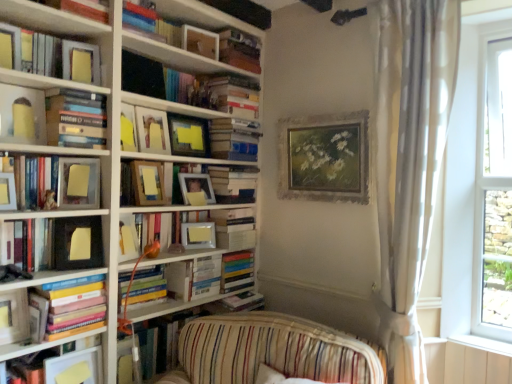
Where is `matte glass picture frame at left, which ranks as the eighth picture frame in right-to-left order`? This screenshot has height=384, width=512. matte glass picture frame at left, which ranks as the eighth picture frame in right-to-left order is located at coordinates (78, 183).

What do you see at coordinates (73, 306) in the screenshot? This screenshot has height=384, width=512. I see `hardcover books at left, which is the fourteenth book from top to bottom` at bounding box center [73, 306].

Measure the distance between hardcover books at left, the 8th book ordered from the bottom, and camera.

hardcover books at left, the 8th book ordered from the bottom, and camera are 5.34 feet apart.

The image size is (512, 384). Describe the element at coordinates (187, 85) in the screenshot. I see `matte black book at upper center, which is the 5th book from top to bottom` at that location.

Image resolution: width=512 pixels, height=384 pixels. Describe the element at coordinates (59, 243) in the screenshot. I see `matte black frame at left, which is the third book from bottom to top` at that location.

You are a GUI agent. You are given a task and a screenshot of the screen. Output one action in this format:
    pyautogui.click(x=<x>, y=<y>)
    Task: Click on the hardcover book at center, which ranks as the tenth book in top-to-bottom order
    
    Given the screenshot: What is the action you would take?
    pyautogui.click(x=233, y=183)

Considering the relative positions of wooden book at upper center, the fourth book when ordered from top to bottom, and matte black picture frame at upper left, positioned as the second picture frame in left-to-right order, in the image provided, is wooden book at upper center, the fourth book when ordered from top to bottom, to the left or to the right of matte black picture frame at upper left, positioned as the second picture frame in left-to-right order,?

wooden book at upper center, the fourth book when ordered from top to bottom, is to the right of matte black picture frame at upper left, positioned as the second picture frame in left-to-right order.

Would you consider wooden book at upper center, marked as the twelfth book in a bottom-to-top arrangement, to be distant from matte black picture frame at upper left, positioned as the second picture frame in left-to-right order?

Yes, wooden book at upper center, marked as the twelfth book in a bottom-to-top arrangement, is far from matte black picture frame at upper left, positioned as the second picture frame in left-to-right order.

From the image's perspective, between wooden book at upper center, the fourth book when ordered from top to bottom, and matte black picture frame at upper left, positioned as the second picture frame in left-to-right order, who is located below?

matte black picture frame at upper left, positioned as the second picture frame in left-to-right order, from the image's perspective.

Considering the sizes of objects wooden book at upper center, marked as the twelfth book in a bottom-to-top arrangement, and matte black picture frame at upper left, which is the 9th picture frame from right to left, in the image provided, who is smaller, wooden book at upper center, marked as the twelfth book in a bottom-to-top arrangement, or matte black picture frame at upper left, which is the 9th picture frame from right to left,?

matte black picture frame at upper left, which is the 9th picture frame from right to left.

Is hardcover book at upper left, marked as the fifteenth book in a bottom-to-top arrangement, positioned far away from yellow sticky note paper at lower left, placed as the 15th book when sorted from top to bottom?

Yes.

Is hardcover book at upper left, marked as the fifteenth book in a bottom-to-top arrangement, inside or outside of yellow sticky note paper at lower left, the 1th book from the bottom?

hardcover book at upper left, marked as the fifteenth book in a bottom-to-top arrangement, is spatially situated outside yellow sticky note paper at lower left, the 1th book from the bottom.

From the image's perspective, is hardcover book at upper left, placed as the first book when sorted from top to bottom, on top of yellow sticky note paper at lower left, placed as the 15th book when sorted from top to bottom?

Yes.

Which point is more forward, (x=69, y=6) or (x=54, y=342)?

The point (x=54, y=342) is closer.

Who is taller, matte yellow paper at upper center, the 5th picture frame viewed from the right, or matte wooden book at center, the twelfth book when ordered from top to bottom?

matte yellow paper at upper center, the 5th picture frame viewed from the right, is taller.

From a real-world perspective, is matte yellow paper at upper center, the sixth picture frame from the left, above or below matte wooden book at center, the twelfth book when ordered from top to bottom?

matte yellow paper at upper center, the sixth picture frame from the left, is situated higher than matte wooden book at center, the twelfth book when ordered from top to bottom, in the real world.

Is matte yellow paper at upper center, the sixth picture frame from the left, next to matte wooden book at center, positioned as the 4th book in bottom-to-top order, and touching it?

matte yellow paper at upper center, the sixth picture frame from the left, and matte wooden book at center, positioned as the 4th book in bottom-to-top order, are clearly separated.

From the image's perspective, which object appears higher, matte yellow paper at upper center, the sixth picture frame from the left, or matte wooden book at center, positioned as the 4th book in bottom-to-top order?

matte yellow paper at upper center, the sixth picture frame from the left, from the image's perspective.

From the image's perspective, would you say hardcover book at center, positioned as the sixth book in bottom-to-top order, is shown under matte wooden book at center, positioned as the 4th book in bottom-to-top order?

No.

From a real-world perspective, relative to matte wooden book at center, the twelfth book when ordered from top to bottom, is hardcover book at center, positioned as the sixth book in bottom-to-top order, vertically above or below?

From a real-world perspective, hardcover book at center, positioned as the sixth book in bottom-to-top order, is physically above matte wooden book at center, the twelfth book when ordered from top to bottom.

Is hardcover book at center, which ranks as the tenth book in top-to-bottom order, placed right next to matte wooden book at center, positioned as the 4th book in bottom-to-top order?

No, hardcover book at center, which ranks as the tenth book in top-to-bottom order, is not next to matte wooden book at center, positioned as the 4th book in bottom-to-top order.

Is hardcover book at center, positioned as the sixth book in bottom-to-top order, oriented towards matte wooden book at center, the twelfth book when ordered from top to bottom?

No.

Can you tell me how much matte black picture frame at upper left, which is the 9th picture frame from right to left, and hardcover book at upper left, marked as the fifteenth book in a bottom-to-top arrangement, differ in facing direction?

They differ by 2.38 degrees in their facing directions.

Considering the relative positions of matte black picture frame at upper left, which is the 9th picture frame from right to left, and hardcover book at upper left, placed as the first book when sorted from top to bottom, in the image provided, is matte black picture frame at upper left, which is the 9th picture frame from right to left, to the left of hardcover book at upper left, placed as the first book when sorted from top to bottom, from the viewer's perspective?

Indeed, matte black picture frame at upper left, which is the 9th picture frame from right to left, is positioned on the left side of hardcover book at upper left, placed as the first book when sorted from top to bottom.

Relative to hardcover book at upper left, marked as the fifteenth book in a bottom-to-top arrangement, is matte black picture frame at upper left, which is the 9th picture frame from right to left, in front or behind?

Visually, matte black picture frame at upper left, which is the 9th picture frame from right to left, is located in front of hardcover book at upper left, marked as the fifteenth book in a bottom-to-top arrangement.

Considering the sizes of matte black picture frame at upper left, which is the 9th picture frame from right to left, and matte silver picture frame at left, which is counted as the tenth picture frame, starting from the right, in the image, is matte black picture frame at upper left, which is the 9th picture frame from right to left, taller or shorter than matte silver picture frame at left, which is counted as the tenth picture frame, starting from the right,?

Clearly, matte black picture frame at upper left, which is the 9th picture frame from right to left, is taller compared to matte silver picture frame at left, which is counted as the tenth picture frame, starting from the right.

Is matte silver picture frame at left, which is counted as the tenth picture frame, starting from the right, at the back of matte black picture frame at upper left, positioned as the second picture frame in left-to-right order?

matte black picture frame at upper left, positioned as the second picture frame in left-to-right order, does not have its back to matte silver picture frame at left, which is counted as the tenth picture frame, starting from the right.

Is matte black picture frame at upper left, which is the 9th picture frame from right to left, outside of matte silver picture frame at left, which is counted as the tenth picture frame, starting from the right?

Yes, matte black picture frame at upper left, which is the 9th picture frame from right to left, is not within matte silver picture frame at left, which is counted as the tenth picture frame, starting from the right.

Could you measure the distance between matte black picture frame at upper left, positioned as the second picture frame in left-to-right order, and matte silver picture frame at left, positioned as the 1th picture frame in left-to-right order?

matte black picture frame at upper left, positioned as the second picture frame in left-to-right order, is 18.49 inches from matte silver picture frame at left, positioned as the 1th picture frame in left-to-right order.

Which paperback book is the 2nd one when counting from the left side of the striped fabric armchair at lower center? Please provide its 2D coordinates.

[(77, 243)]

Is yellow paper at left, which ranks as the first paperback book in bottom-to-top order, far from striped fabric armchair at lower center?

yellow paper at left, which ranks as the first paperback book in bottom-to-top order, is actually quite close to striped fabric armchair at lower center.

Can you confirm if yellow paper at left, which ranks as the first paperback book in bottom-to-top order, is thinner than striped fabric armchair at lower center?

Indeed, yellow paper at left, which ranks as the first paperback book in bottom-to-top order, has a lesser width compared to striped fabric armchair at lower center.

Where is `the 12th book behind when counting from the matte black picture frame at upper left, positioned as the second picture frame in left-to-right order`? The width and height of the screenshot is (512, 384). the 12th book behind when counting from the matte black picture frame at upper left, positioned as the second picture frame in left-to-right order is located at coordinates pos(239,50).

Where is `the 14th book below the hardcover book at upper left, placed as the first book when sorted from top to bottom (from the image's perspective)`? the 14th book below the hardcover book at upper left, placed as the first book when sorted from top to bottom (from the image's perspective) is located at coordinates (42, 345).

Based on their spatial positions, is yellow sticky note paper at lower left, the 1th book from the bottom, or matte black book at upper center, which is the 5th book from top to bottom, further from hardcover books at center, which is the seventh book in bottom-to-top order?

The object further to hardcover books at center, which is the seventh book in bottom-to-top order, is yellow sticky note paper at lower left, the 1th book from the bottom.

Considering their positions, is matte black picture frame at upper left, which is the 9th picture frame from right to left, positioned further to matte glass picture frame at left, which ranks as the eighth picture frame in right-to-left order, than wooden bookcase at left?

matte black picture frame at upper left, which is the 9th picture frame from right to left, is positioned further to the anchor matte glass picture frame at left, which ranks as the eighth picture frame in right-to-left order.

Estimate the real-world distances between objects in this image. Which object is closer to matte plastic picture frame at upper center, placed as the seventh picture frame when sorted from left to right, wooden picture frame at upper center, acting as the 9th picture frame starting from the left, or hardcover book at upper left, marked as the fifteenth book in a bottom-to-top arrangement?

wooden picture frame at upper center, acting as the 9th picture frame starting from the left, is closer to matte plastic picture frame at upper center, placed as the seventh picture frame when sorted from left to right.

Based on their spatial positions, is hardcover book at upper center, which is the 14th book in bottom-to-top order, or yellow sticky note paper at lower left, placed as the 15th book when sorted from top to bottom, further from matte yellow sticky note at upper left, which ranks as the 7th book in top-to-bottom order?

yellow sticky note paper at lower left, placed as the 15th book when sorted from top to bottom, is further to matte yellow sticky note at upper left, which ranks as the 7th book in top-to-bottom order.

In the scene shown: Based on their spatial positions, is matte wooden shelf at center, the 2th shelf in the top-to-bottom sequence, or matte silver picture frame at left, positioned as the 1th picture frame in left-to-right order, closer to wooden picture frame at upper center, marked as the second picture frame in a right-to-left arrangement?

matte silver picture frame at left, positioned as the 1th picture frame in left-to-right order, lies closer to wooden picture frame at upper center, marked as the second picture frame in a right-to-left arrangement, than the other object.

From the image, which object appears to be nearer to wooden bookcase at left, matte wooden book at center, positioned as the 4th book in bottom-to-top order, or wooden picture frame at center, which is counted as the 4th picture frame, starting from the left?

wooden picture frame at center, which is counted as the 4th picture frame, starting from the left, is positioned closer to the anchor wooden bookcase at left.

Considering their positions, is wooden book at upper center, the fourth book when ordered from top to bottom, positioned closer to matte yellow sticky note at upper left, which ranks as the 7th book in top-to-bottom order, than wooden picture frame at upper center, marked as the second picture frame in a right-to-left arrangement?

Based on the image, wooden picture frame at upper center, marked as the second picture frame in a right-to-left arrangement, appears to be nearer to matte yellow sticky note at upper left, which ranks as the 7th book in top-to-bottom order.

When comparing their distances from matte black book at upper center, which appears as the 11th book when ordered from the bottom, does wooden frame at center, the second shelf ordered from the bottom, or hardcover book at center, positioned as the sixth book in bottom-to-top order, seem closer?

wooden frame at center, the second shelf ordered from the bottom, is positioned closer to the anchor matte black book at upper center, which appears as the 11th book when ordered from the bottom.

At what (x,y) coordinates should I click in order to perform the action: click on curtain between striped fabric armchair at lower center and matte plastic picture frame at upper center, the 4th picture frame in the right-to-left sequence, from front to back. Please return your answer as a coordinate pair (x, y). This screenshot has width=512, height=384. Looking at the image, I should click on (409, 161).

Identify the location of paperback book that lies between wooden book at upper center, marked as the twelfth book in a bottom-to-top arrangement, and white cardboard box at center, positioned as the eleventh book in top-to-bottom order, from top to bottom. The image size is (512, 384). (81, 62).

Locate an element on the screen. bookcase situated between matte yellow paper at upper left, which is counted as the second paperback book, starting from the bottom, and white sheer curtain at right from left to right is located at coordinates (106, 137).

Where is `shelf between hardcover book at upper center, which is counted as the 13th book, starting from the bottom, and matte wooden book at center, positioned as the 4th book in bottom-to-top order, vertically`? This screenshot has height=384, width=512. shelf between hardcover book at upper center, which is counted as the 13th book, starting from the bottom, and matte wooden book at center, positioned as the 4th book in bottom-to-top order, vertically is located at coordinates (184, 164).